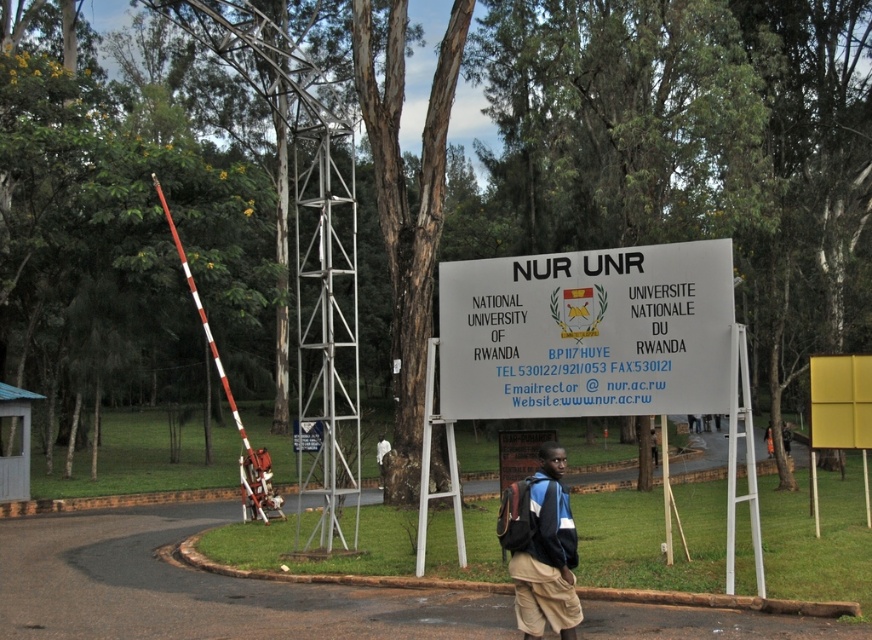
You are a visitor standing at the entrance of the National University of Rwanda and see the khaki shorts at center and the yellow matte sign at center. Which object is nearer to you?

The khaki shorts at center is closer to the viewer than the yellow matte sign at center.

You are a visitor at the entrance of the National University of Rwanda. You see a white paper sign at center and a yellow matte sign at center. Which sign is wider?

The white paper sign at center might be wider than yellow matte sign at center.

You are standing at the entrance of the National University of Rwanda and want to locate the white paper sign at center. According to the map coordinates provided, where exactly should you look?

The white paper sign at center is located at point (587, 332).